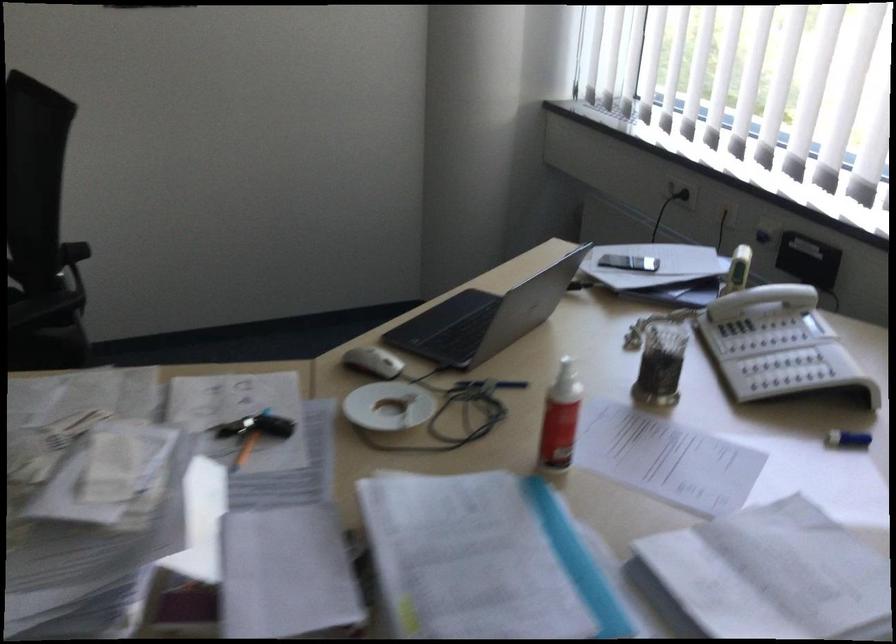
Where would you support the black chair armrest? Please return your answer as a coordinate pair (x, y).

(73, 252)